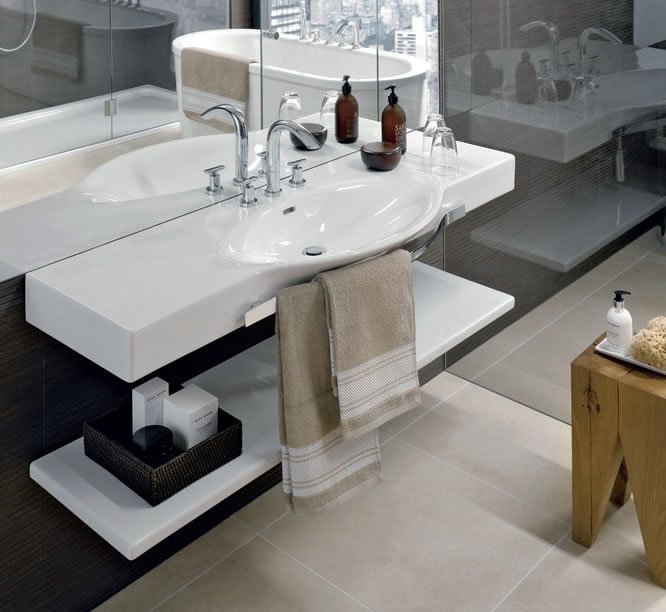
Locate an element on the screen. The height and width of the screenshot is (612, 666). brown (hand) towel is located at coordinates (380, 327).